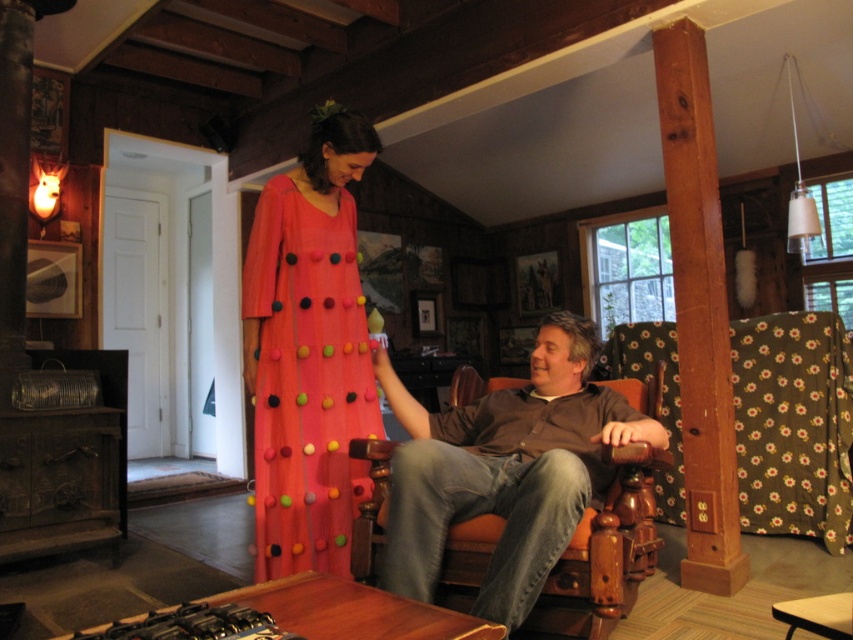
Based on the photo, you are a photographer setting up a shoot in this rustic living room. You need to position a light source above the brown leather chair at center so it illuminates the matte coral dress at center. Is the current arrangement of the objects suitable for this lighting setup?

The brown leather chair at center is below matte coral dress at center, so placing a light source above the chair would also illuminate the matte coral dress at center since it is positioned above the chair.

You are standing in the rustic living room and want to move from the entrance to the wooden pillar in the foreground. There is a brown leather chair at center and a matte coral dress at center in your way. Which object should you move around to reach the pillar safely?

You should move around the brown leather chair at center because it is to the right of the matte coral dress at center, so navigating around it would provide a clear path to the wooden pillar.